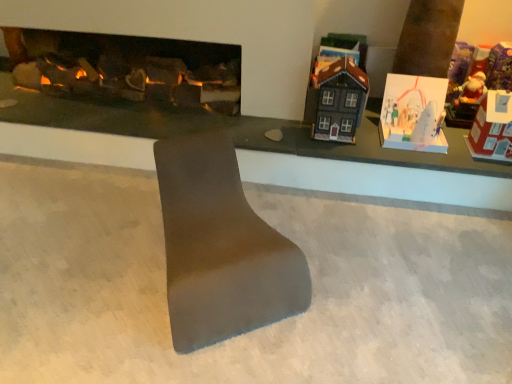
Question: Is matte black house at upper right, placed as the 2th toy when sorted from left to right, spatially inside red cardboard house at right, placed as the 4th toy when sorted from left to right, or outside of it?

Choices:
 (A) outside
 (B) inside

Answer: (A)

Question: From the image's perspective, is matte black house at upper right, placed as the 2th toy when sorted from left to right, above or below red cardboard house at right, which is counted as the first toy, starting from the right?

Choices:
 (A) below
 (B) above

Answer: (B)

Question: Which is farther from the matte gray footrest at center?

Choices:
 (A) matte gray table at center
 (B) white paper card at upper right, the 3th toy in the left-to-right sequence
 (C) matte black house at upper right, the third toy positioned from the right
 (D) red cardboard house at right, which is counted as the first toy, starting from the right
 (E) smooth gray concrete at center

Answer: (D)

Question: Based on their relative distances, which object is farther from the red cardboard house at right, which is counted as the first toy, starting from the right?

Choices:
 (A) matte gray footrest at center
 (B) matte gray table at center
 (C) dark gray matte house at upper right, arranged as the fourth toy when viewed from the right
 (D) white paper card at upper right, acting as the second toy starting from the right
 (E) smooth gray concrete at center

Answer: (A)